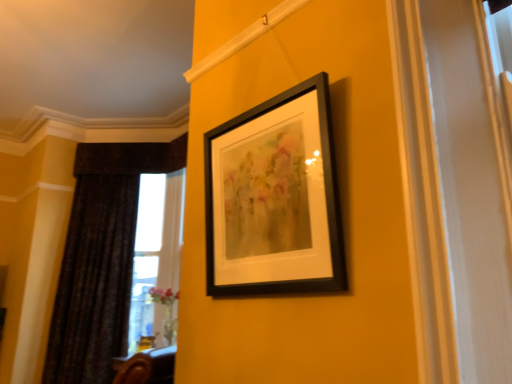
Question: Is black matte picture frame at upper center spatially inside dark velvet curtain at left, or outside of it?

Choices:
 (A) outside
 (B) inside

Answer: (A)

Question: From their relative heights in the image, would you say black matte picture frame at upper center is taller or shorter than dark velvet curtain at left?

Choices:
 (A) short
 (B) tall

Answer: (A)

Question: Considering their positions, is black matte picture frame at upper center located in front of or behind dark velvet curtain at left?

Choices:
 (A) front
 (B) behind

Answer: (A)

Question: From the image's perspective, is dark velvet curtain at left located above or below black matte picture frame at upper center?

Choices:
 (A) above
 (B) below

Answer: (B)

Question: Considering the positions of point (117, 299) and point (300, 84), is point (117, 299) closer or farther from the camera than point (300, 84)?

Choices:
 (A) closer
 (B) farther

Answer: (B)

Question: Is dark velvet curtain at left in front of or behind black matte picture frame at upper center in the image?

Choices:
 (A) behind
 (B) front

Answer: (A)

Question: Looking at the image, does dark velvet curtain at left seem bigger or smaller compared to black matte picture frame at upper center?

Choices:
 (A) big
 (B) small

Answer: (A)